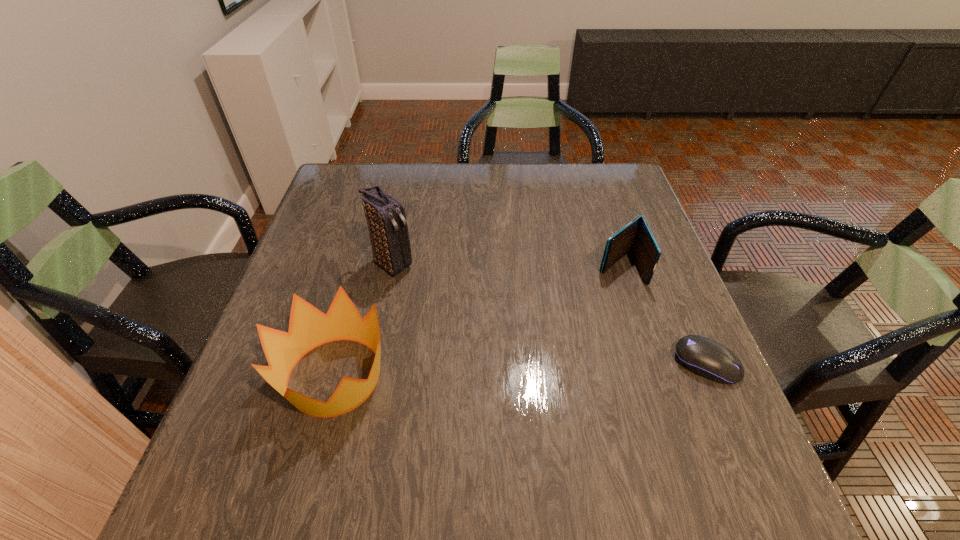
In the image, there is a desktop. What are the coordinates of `free space at the right edge` in the screenshot? It's located at (606, 209).

Identify the location of free location at the far left corner. This screenshot has width=960, height=540. (372, 168).

Locate an element on the screen. The height and width of the screenshot is (540, 960). free point at the near left corner is located at coordinates (277, 409).

At what (x,y) coordinates should I click in order to perform the action: click on vacant area that lies between the second shortest object and the shortest object. Please return your answer as a coordinate pair (x, y). This screenshot has width=960, height=540. Looking at the image, I should click on (663, 315).

I want to click on empty space between the second shortest object and the second tallest object, so click(x=477, y=321).

The width and height of the screenshot is (960, 540). In order to click on free area in between the wallet and the computer mouse in this screenshot , I will do `click(663, 315)`.

The width and height of the screenshot is (960, 540). What are the coordinates of `vacant region between the shortest object and the third tallest object` in the screenshot? It's located at coord(663,315).

Where is `empty space between the wallet and the computer mouse`? The image size is (960, 540). empty space between the wallet and the computer mouse is located at coordinates (663, 315).

You are a GUI agent. You are given a task and a screenshot of the screen. Output one action in this format:
    pyautogui.click(x=<x>, y=<y>)
    Task: Click on the free space between the second shortest object and the shortest object
    
    Given the screenshot: What is the action you would take?
    pyautogui.click(x=663, y=315)

Find the location of a particular element. This screenshot has width=960, height=540. free spot between the tallest object and the wallet is located at coordinates (506, 265).